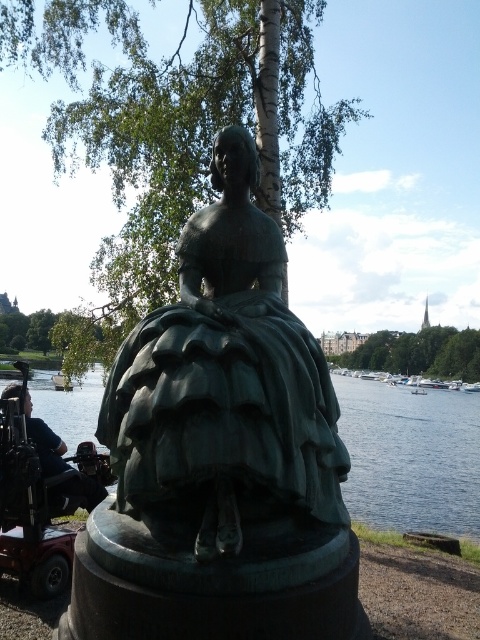
You are an art student standing in front of the green patina statue at center and the green bronze statue at center. Which one is closer to you?

The green patina statue at center is closer to you because it is positioned in front of the green bronze statue at center.

You are a tour guide leading a group to the green bronze statue at center. A visitor asks if the statue is taller than the metallic red mobility scooter at lower left. How do you respond?

The green bronze statue at center is shorter than the metallic red mobility scooter at lower left, so the statue is not taller than the scooter.